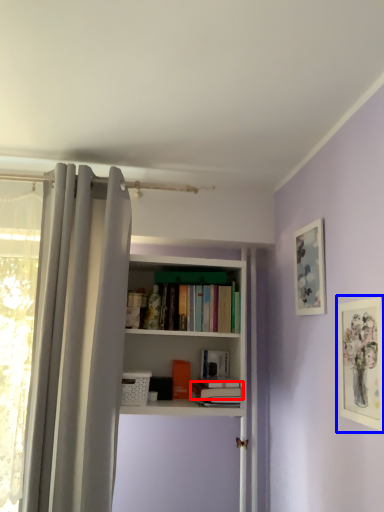
Question: Which point is further to the camera, book (highlighted by a red box) or picture frame (highlighted by a blue box)?

Choices:
 (A) book
 (B) picture frame

Answer: (A)